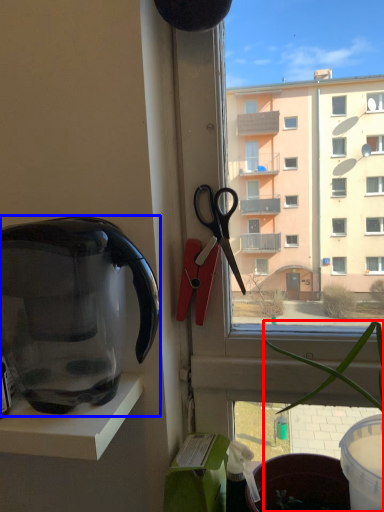
Question: Which point is closer to the camera, houseplant (highlighted by a red box) or kettle (highlighted by a blue box)?

Choices:
 (A) houseplant
 (B) kettle

Answer: (A)